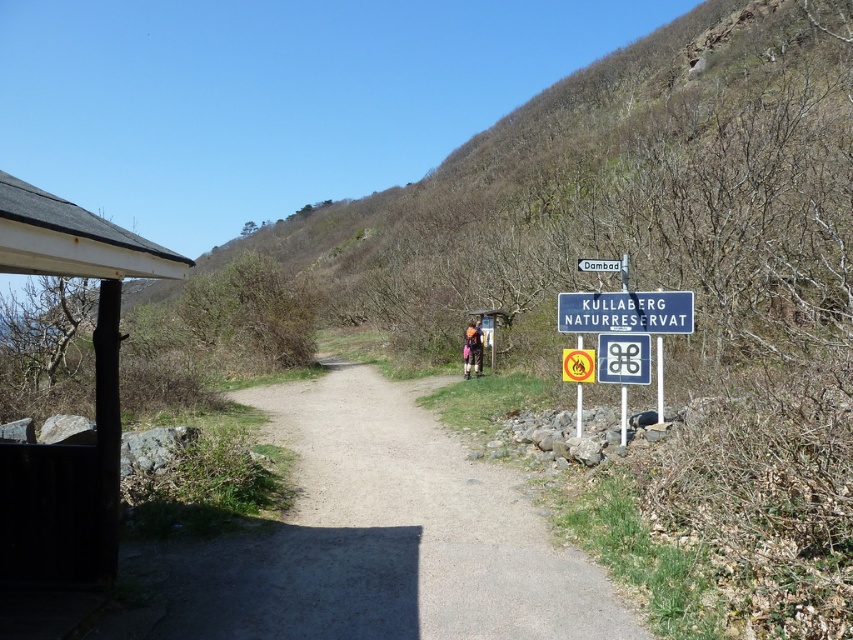
Question: In this image, where is blue plastic sign at center located relative to white plastic sign at upper center?

Choices:
 (A) left
 (B) right

Answer: (B)

Question: Among these points, which one is nearest to the camera?

Choices:
 (A) (595, 259)
 (B) (428, 564)
 (C) (593, 312)

Answer: (B)

Question: Which point is farther to the camera?

Choices:
 (A) white plastic sign at upper center
 (B) dirt path at center

Answer: (A)

Question: Can you confirm if brown fabric backpack at center is wider than white plastic sign at upper center?

Choices:
 (A) no
 (B) yes

Answer: (A)

Question: Which is farther from the brown leather backpack at center?

Choices:
 (A) blue plastic sign at center
 (B) dirt path at center
 (C) white plastic sign at upper center

Answer: (C)

Question: Can you confirm if dirt path at center is bigger than blue plastic sign at center?

Choices:
 (A) yes
 (B) no

Answer: (A)